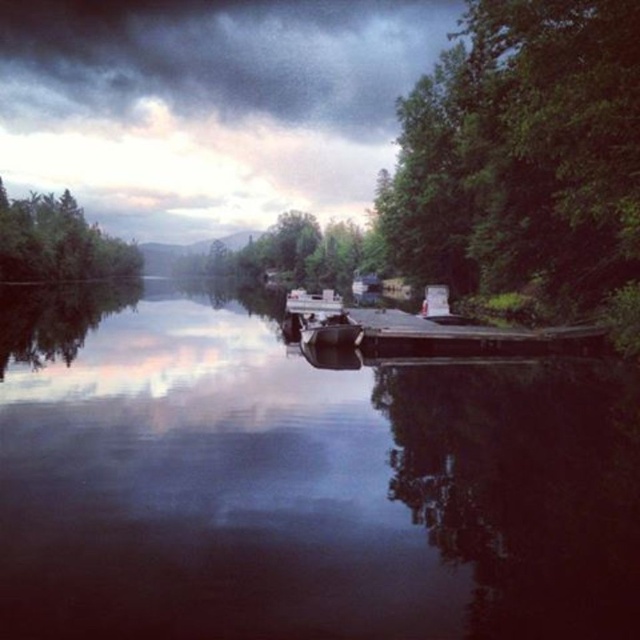
Based on the photo, you are standing on the wooden dock and want to take a photo of the smooth dark water at center and the smooth wood dock at center. Which object should you position to your right side to capture both in the frame?

You should position the smooth wood dock at center to your right side because the smooth dark water at center is located to the left of the smooth wood dock at center.

You are standing on the dock and see two points in the water. One is at point coordinates point (444, 321) and the other at point coordinates point (310, 316). Which point is farther away from you?

Point (444, 321) is behind point (310, 316), so it is farther away from you.

Consider the image. You are standing on the smooth wood dock at center and want to board the metallic gray boat at center. Which direction should you walk to reach the boat?

Since the smooth wood dock at center is closer to the viewer than the metallic gray boat at center, you should walk away from your current position towards the boat. The boat is further away from you, so moving forward along the dock will bring you closer to the metallic gray boat at center.